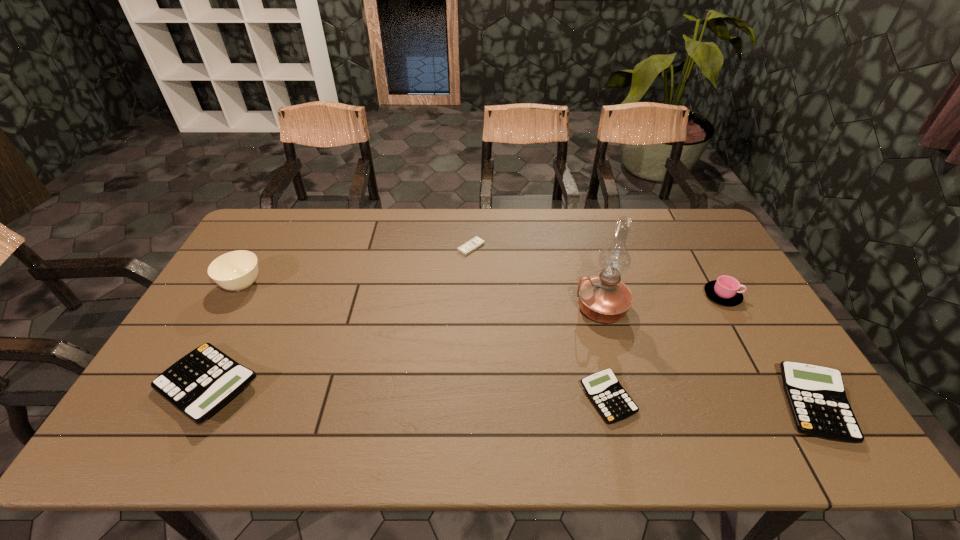
Locate an element on the screen. the leftmost calculator is located at coordinates (200, 383).

Where is `the second calculator from right to left`? Image resolution: width=960 pixels, height=540 pixels. the second calculator from right to left is located at coordinates (614, 404).

This screenshot has width=960, height=540. What are the coordinates of `the shortest calculator` in the screenshot? It's located at (614, 404).

Locate an element on the screen. The height and width of the screenshot is (540, 960). the second tallest calculator is located at coordinates (816, 395).

Locate an element on the screen. Image resolution: width=960 pixels, height=540 pixels. the rightmost calculator is located at coordinates (816, 395).

Where is `the tallest object`? This screenshot has height=540, width=960. the tallest object is located at coordinates (604, 298).

You are a GUI agent. You are given a task and a screenshot of the screen. Output one action in this format:
    pyautogui.click(x=<x>, y=<y>)
    Task: Click on the money
    The height and width of the screenshot is (540, 960).
    Given the screenshot: What is the action you would take?
    pyautogui.click(x=465, y=249)

Locate an element on the screen. The image size is (960, 540). the shortest object is located at coordinates (465, 249).

Where is `cup`? cup is located at coordinates (725, 290).

The height and width of the screenshot is (540, 960). I want to click on the sixth shortest object, so click(x=236, y=271).